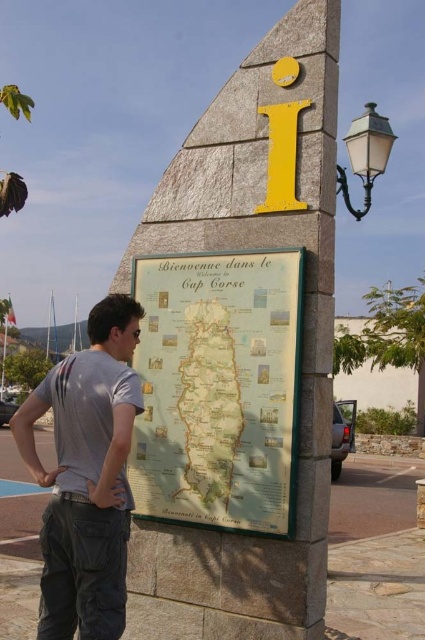
Can you confirm if map at center is shorter than gray cotton t-shirt at center?

Yes.

What do you see at coordinates (218, 388) in the screenshot? Image resolution: width=425 pixels, height=640 pixels. I see `map at center` at bounding box center [218, 388].

What do you see at coordinates (218, 388) in the screenshot?
I see `map at center` at bounding box center [218, 388].

Where is `map at center`? map at center is located at coordinates (218, 388).